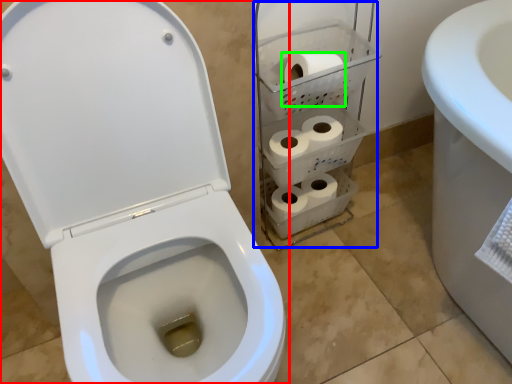
Question: Considering the real-world distances, which object is closest to toilet (highlighted by a red box)? shelf (highlighted by a blue box) or to paper (highlighted by a green box).

Choices:
 (A) shelf
 (B) to paper

Answer: (A)